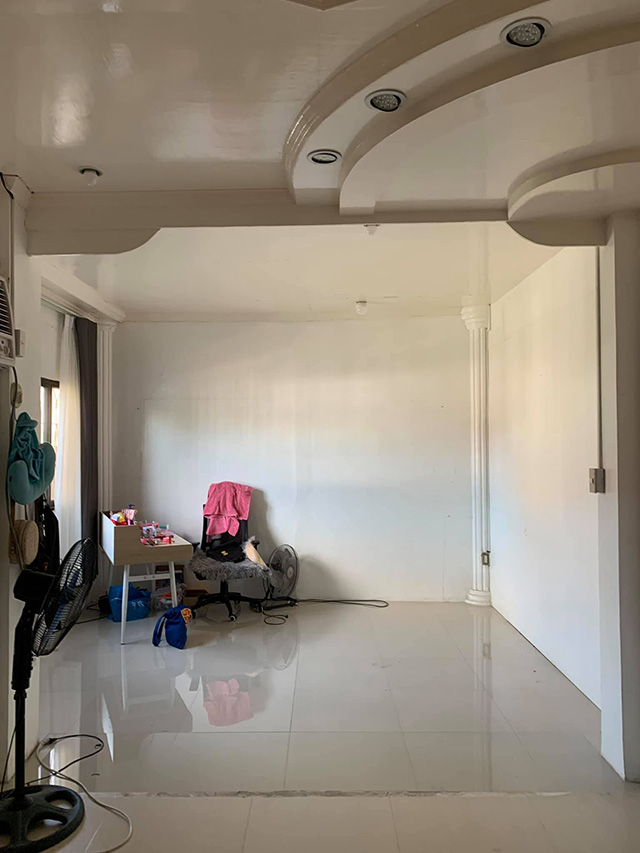
Locate an element on the screen. ceiling inside room is located at coordinates click(184, 64).